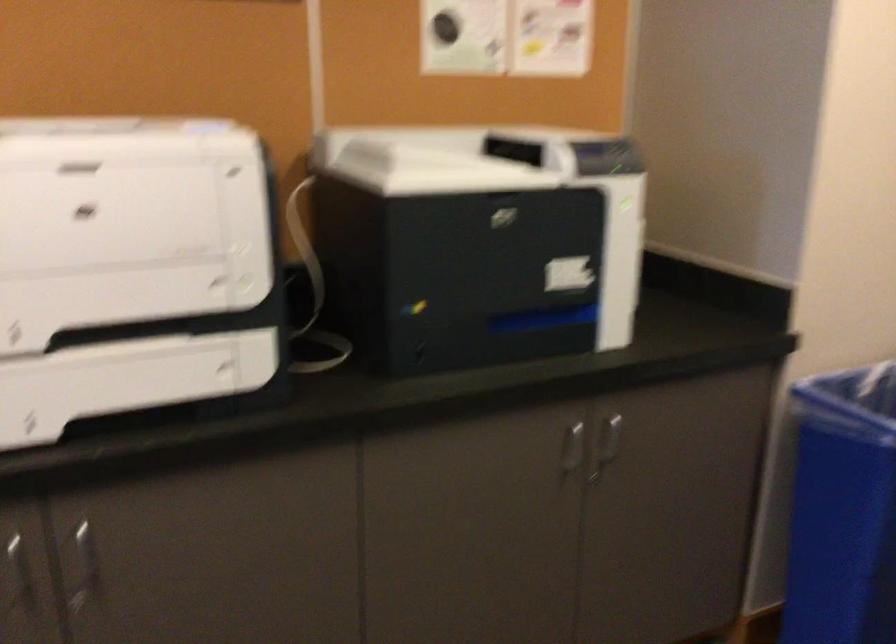
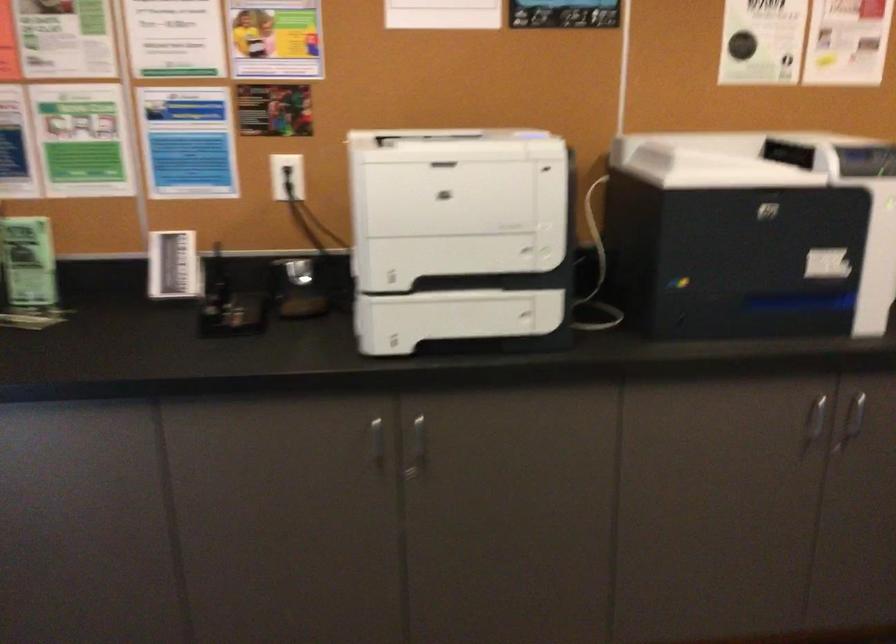
In the second image, find the point that corresponds to (569,453) in the first image.

(815, 422)